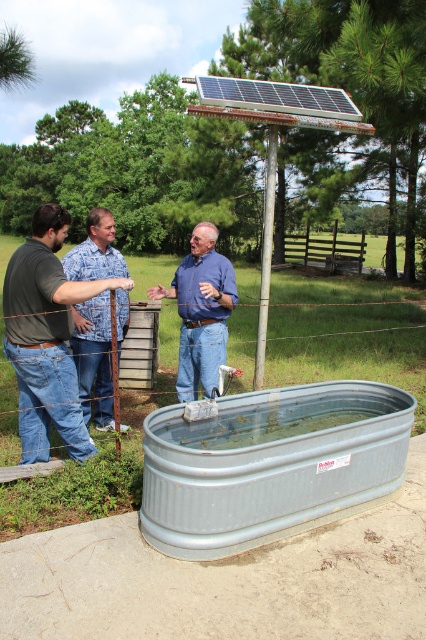
Does galvanized metal tub at lower center have a lesser width compared to matte black shirt at center?

No.

Does galvanized metal tub at lower center appear under matte black shirt at center?

Correct, galvanized metal tub at lower center is located below matte black shirt at center.

Which is in front, point (385, 483) or point (66, 291)?

Positioned in front is point (66, 291).

Where is `galvanized metal tub at lower center`? Image resolution: width=426 pixels, height=640 pixels. galvanized metal tub at lower center is located at coordinates (270, 465).

Does galvanized metal tub at lower center come in front of metallic gray water at center?

Yes, it is in front of metallic gray water at center.

Is galvanized metal tub at lower center to the right of metallic gray water at center from the viewer's perspective?

Indeed, galvanized metal tub at lower center is positioned on the right side of metallic gray water at center.

Find the location of a particular element. galvanized metal tub at lower center is located at coordinates (270, 465).

The width and height of the screenshot is (426, 640). What are the coordinates of `galvanized metal tub at lower center` in the screenshot? It's located at (270, 465).

Is point (158, 412) more distant than point (184, 342)?

No, it is not.

This screenshot has height=640, width=426. Identify the location of galvanized metal tub at lower center. (270, 465).

The height and width of the screenshot is (640, 426). Describe the element at coordinates (270, 465) in the screenshot. I see `galvanized metal tub at lower center` at that location.

Where is `galvanized metal tub at lower center`? The height and width of the screenshot is (640, 426). galvanized metal tub at lower center is located at coordinates (270, 465).